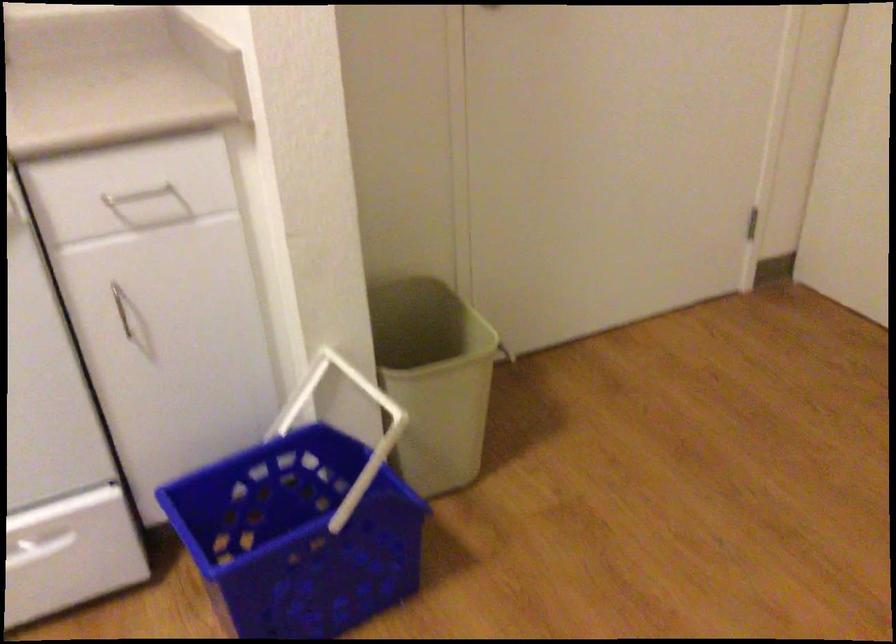
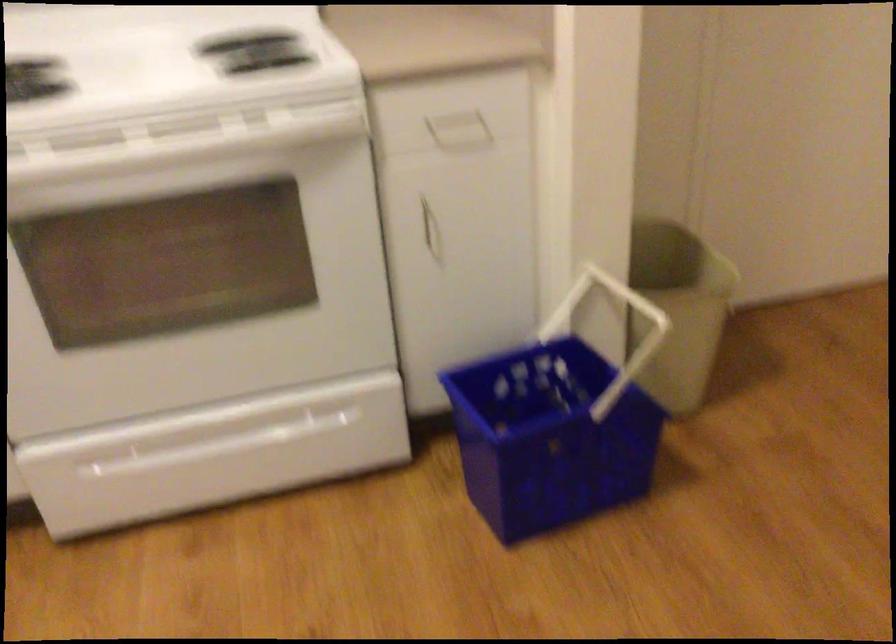
In the second image, find the point that corresponds to [435,383] in the first image.

(678, 308)